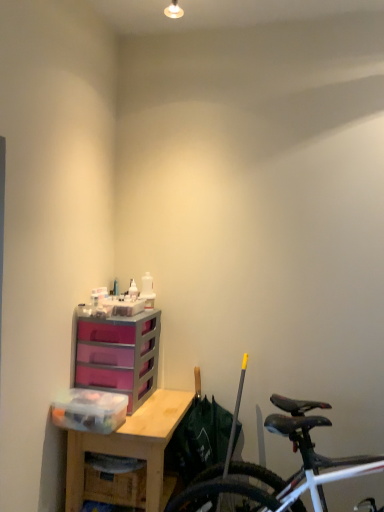
Image resolution: width=384 pixels, height=512 pixels. In order to click on free location to the right of transparent plastic storage box at left in this screenshot , I will do `click(144, 419)`.